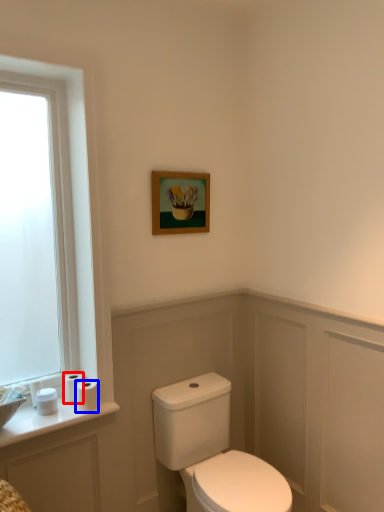
Question: Which of the following is the closest to the observer, toilet paper (highlighted by a red box) or toilet paper (highlighted by a blue box)?

Choices:
 (A) toilet paper
 (B) toilet paper

Answer: (B)